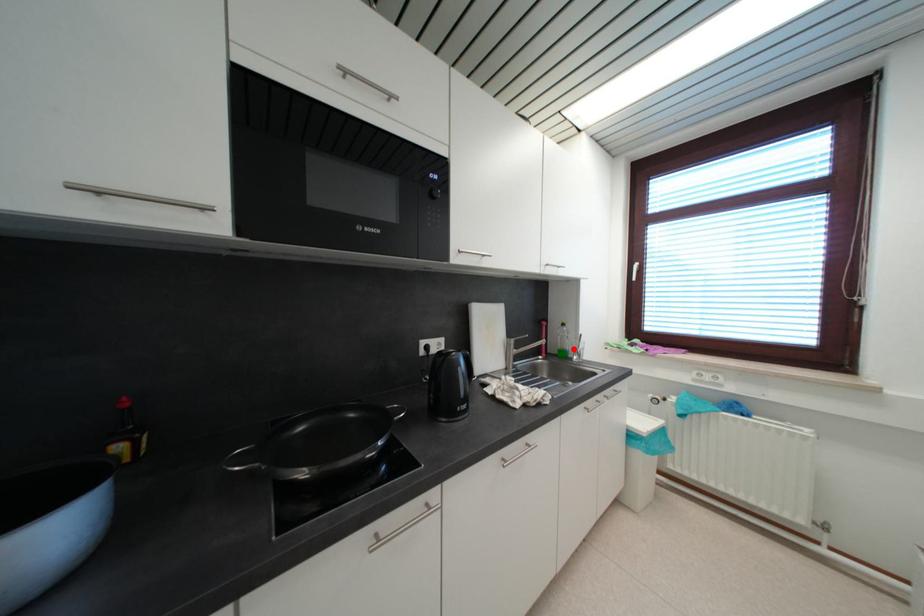
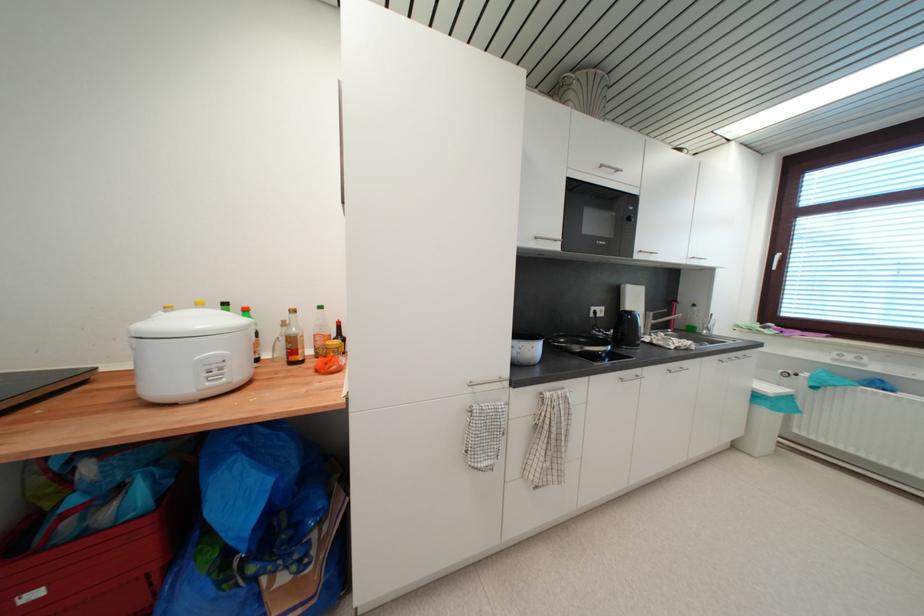
Find the pixel in the second image that matches the highlighted location in the first image.

(701, 326)